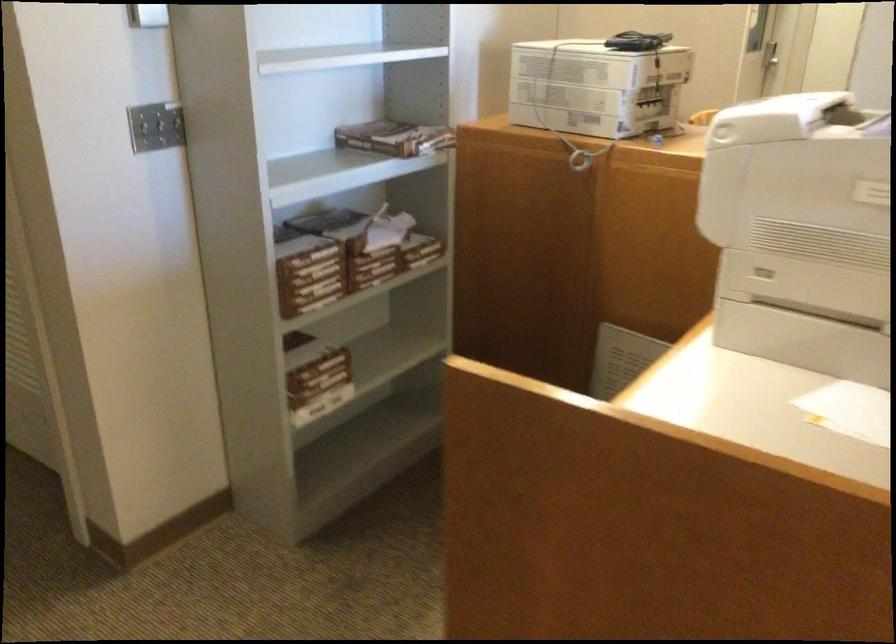
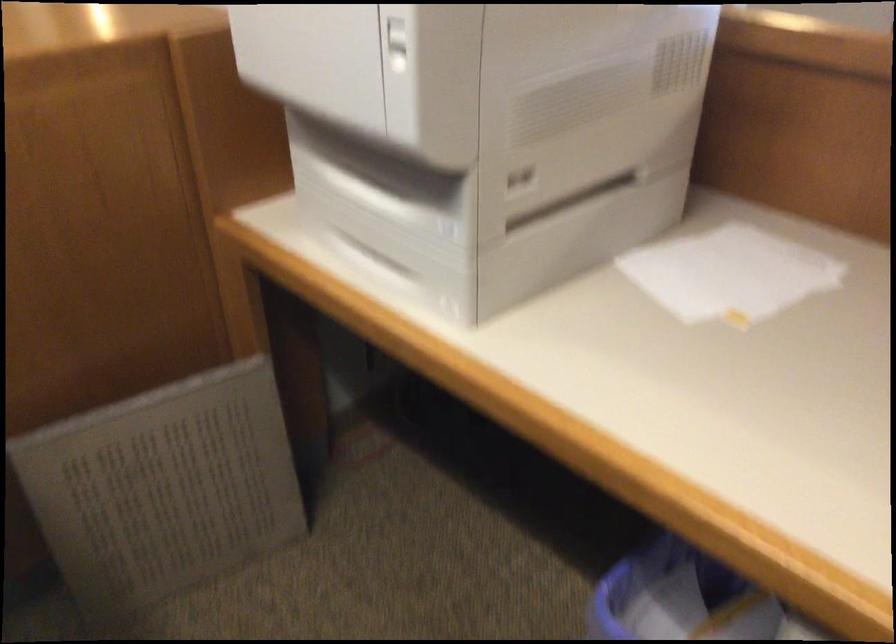
Find the pixel in the second image that matches the point at 727,172 in the first image.

(397, 44)